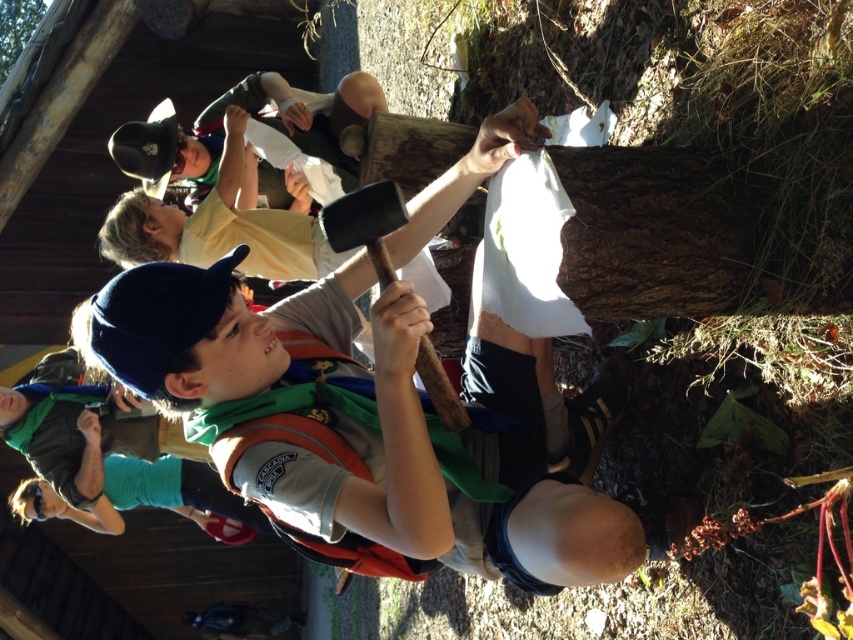
In the scene shown: Does matte orange vest at center have a lesser width compared to green fabric shirt at lower left?

Result: Incorrect, matte orange vest at center's width is not less than green fabric shirt at lower left's.

Is point (112, 362) positioned after point (109, 520)?

No, it is in front of (109, 520).

Does point (291, 323) come behind point (234, 512)?

That is False.

Locate an element on the screen. matte orange vest at center is located at coordinates (467, 458).